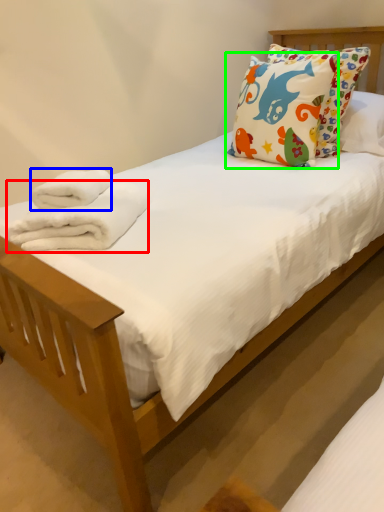
Question: Which object is the farthest from bath towel (highlighted by a red box)? Choose among these: bath towel (highlighted by a blue box) or pillow (highlighted by a green box).

Choices:
 (A) bath towel
 (B) pillow

Answer: (B)